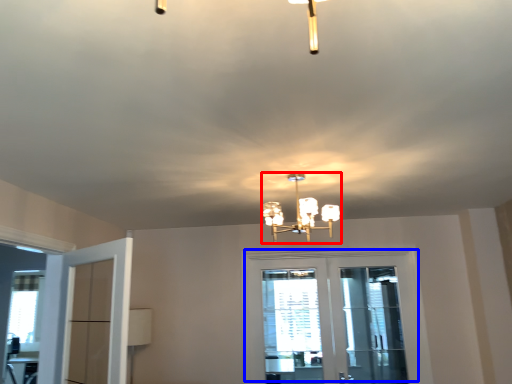
Question: Which object appears closest to the camera in this image, lamp (highlighted by a red box) or door (highlighted by a blue box)?

Choices:
 (A) lamp
 (B) door

Answer: (A)